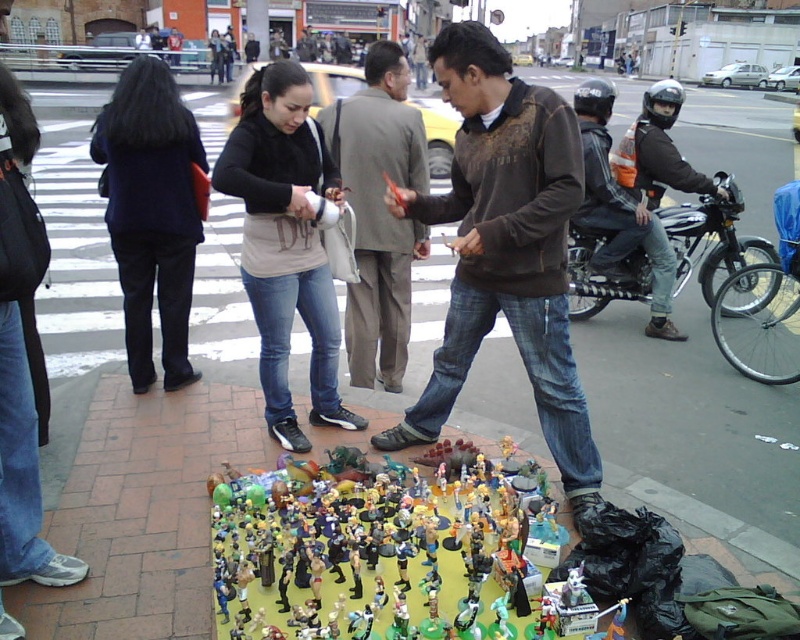
You are standing in the market scene described. There is a point marked at coordinates (x=504, y=246). What object is located at this point?

The point at coordinates (x=504, y=246) corresponds to the brown textured sweater at center.

Consider the image. You are a customer at a market stall. You see two items for sale here, the brown textured sweater at center and the light brown textured suit at center. Which item is positioned lower on the display?

The brown textured sweater at center is positioned lower than the light brown textured suit at center.